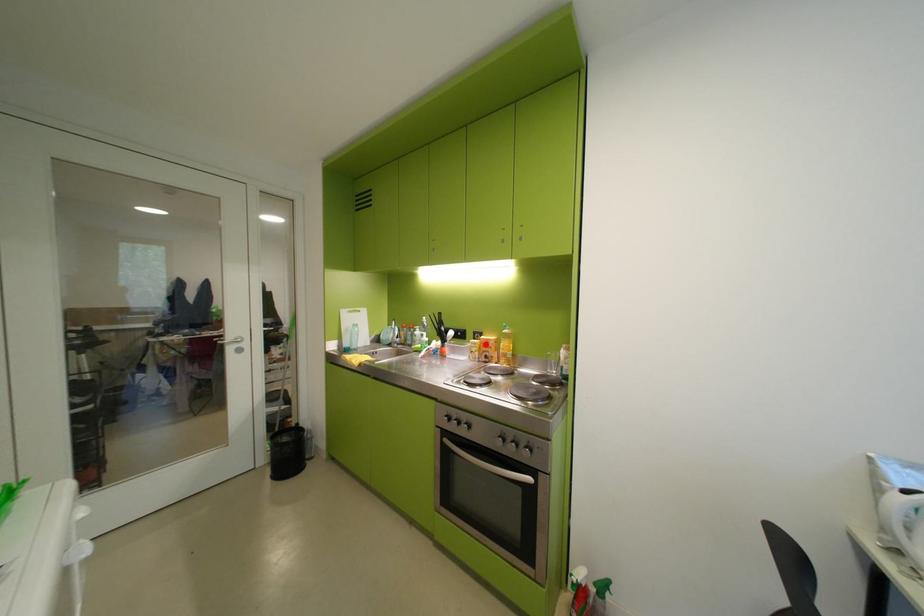
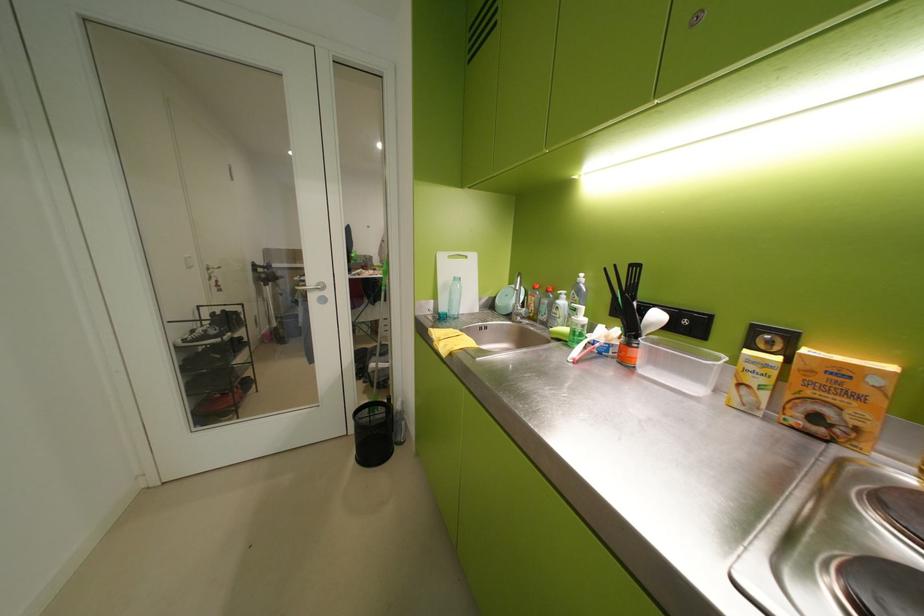
Where in the second image is the point corresponding to the highlighted location from the first image?

(773, 365)